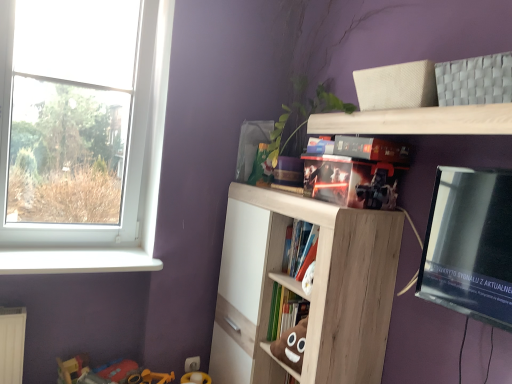
In the scene shown: What is the approximate width of light wood shelf at upper center, which is the second shelf from top to bottom?

It is 14.32 inches.

The height and width of the screenshot is (384, 512). Find the location of `brown plush toy at center, the third book positioned from the top`. brown plush toy at center, the third book positioned from the top is located at coordinates (285, 310).

The width and height of the screenshot is (512, 384). Describe the element at coordinates (76, 260) in the screenshot. I see `white plastic window sill at lower left` at that location.

Measure the distance between light wood shelf at upper center, placed as the first shelf when sorted from top to bottom, and camera.

1.11 meters.

Identify the location of transparent glass window at left. (124, 182).

Locate an element on the screen. The height and width of the screenshot is (384, 512). toy that is under the hardcover book at center, which is counted as the second book, starting from the bottom (from a real-world perspective) is located at coordinates (108, 373).

Who is taller, hardcover book at center, the second book positioned from the top, or plastic toy at lower left?

With more height is plastic toy at lower left.

From a real-world perspective, is hardcover book at center, which is counted as the second book, starting from the bottom, physically located above or below plastic toy at lower left?

hardcover book at center, which is counted as the second book, starting from the bottom, is above plastic toy at lower left.

Can you confirm if hardcover book at center, the second book positioned from the top, is thinner than plastic toy at lower left?

Indeed, hardcover book at center, the second book positioned from the top, has a lesser width compared to plastic toy at lower left.

From the image's perspective, which object appears higher, white plastic window sill at lower left or plastic toy at lower left?

white plastic window sill at lower left.

Considering the sizes of objects white plastic window sill at lower left and plastic toy at lower left in the image provided, who is shorter, white plastic window sill at lower left or plastic toy at lower left?

white plastic window sill at lower left.

Is the position of white plastic window sill at lower left less distant than that of plastic toy at lower left?

Yes, it is.

From a real-world perspective, is white plastic window sill at lower left positioned above or below plastic toy at lower left?

white plastic window sill at lower left is above plastic toy at lower left.

In order to click on shelf that appears on the right of brown plush toy at center, the first book when ordered from bottom to top in this screenshot , I will do `click(418, 121)`.

From a real-world perspective, is light wood shelf at upper center, placed as the first shelf when sorted from top to bottom, over brown plush toy at center, the first book when ordered from bottom to top?

Yes, from a real-world perspective, light wood shelf at upper center, placed as the first shelf when sorted from top to bottom, is on top of brown plush toy at center, the first book when ordered from bottom to top.

Considering the sizes of objects light wood shelf at upper center, placed as the first shelf when sorted from top to bottom, and brown plush toy at center, the third book positioned from the top, in the image provided, who is taller, light wood shelf at upper center, placed as the first shelf when sorted from top to bottom, or brown plush toy at center, the third book positioned from the top,?

brown plush toy at center, the third book positioned from the top, is taller.

From the image's perspective, is light wood shelf at upper center, the second shelf when ordered from bottom to top, located above brown plush toy at center, the third book positioned from the top?

Answer: Correct, light wood shelf at upper center, the second shelf when ordered from bottom to top, appears higher than brown plush toy at center, the third book positioned from the top, in the image.

Based on the photo, how many degrees apart are the facing directions of brown plush toy at center, the first book when ordered from bottom to top, and light wood shelf at upper center, which is the second shelf from top to bottom?

They differ by 0.000579 degrees in their facing directions.

In the scene shown: Is brown plush toy at center, the third book positioned from the top, positioned with its back to light wood shelf at upper center, which is the 1th shelf in bottom-to-top order?

Yes, brown plush toy at center, the third book positioned from the top, is positioned with its back facing light wood shelf at upper center, which is the 1th shelf in bottom-to-top order.

From the image's perspective, is brown plush toy at center, the third book positioned from the top, below light wood shelf at upper center, which is the 1th shelf in bottom-to-top order?

No, from the image's perspective, brown plush toy at center, the third book positioned from the top, is not below light wood shelf at upper center, which is the 1th shelf in bottom-to-top order.

Does point (286, 326) appear closer or farther from the camera than point (274, 382)?

Point (286, 326).

At what (x,y) coordinates should I click in order to perform the action: click on book that is the 2nd one when counting downward from the matt cardboard box at upper center, marked as the 3th book in a bottom-to-top arrangement (from the image's perspective). Please return your answer as a coordinate pair (x, y). Looking at the image, I should click on (285, 310).

From a real-world perspective, which is physically above, matt cardboard box at upper center, marked as the 3th book in a bottom-to-top arrangement, or brown plush toy at center, the third book positioned from the top?

matt cardboard box at upper center, marked as the 3th book in a bottom-to-top arrangement.

How many degrees apart are the facing directions of matt cardboard box at upper center, acting as the first book starting from the top, and brown plush toy at center, the third book positioned from the top?

The angular difference between matt cardboard box at upper center, acting as the first book starting from the top, and brown plush toy at center, the third book positioned from the top, is 1.79 degrees.

Is point (360, 158) more distant than point (284, 298)?

No, it is not.

Is light wood shelf at upper center, the second shelf when ordered from bottom to top, surrounding white plastic window sill at lower left?

No, light wood shelf at upper center, the second shelf when ordered from bottom to top, does not contain white plastic window sill at lower left.

Is light wood shelf at upper center, placed as the first shelf when sorted from top to bottom, at the left side of white plastic window sill at lower left?

No, light wood shelf at upper center, placed as the first shelf when sorted from top to bottom, is not to the left of white plastic window sill at lower left.

Could you tell me if light wood shelf at upper center, the second shelf when ordered from bottom to top, is turned towards white plastic window sill at lower left?

No, light wood shelf at upper center, the second shelf when ordered from bottom to top, is not aimed at white plastic window sill at lower left.

Considering the relative sizes of light wood shelf at upper center, the second shelf when ordered from bottom to top, and white plastic window sill at lower left in the image provided, is light wood shelf at upper center, the second shelf when ordered from bottom to top, shorter than white plastic window sill at lower left?

In fact, light wood shelf at upper center, the second shelf when ordered from bottom to top, may be taller than white plastic window sill at lower left.

Is black glossy tv at upper right to the left of matt cardboard box at upper center, marked as the 3th book in a bottom-to-top arrangement, from the viewer's perspective?

Incorrect, black glossy tv at upper right is not on the left side of matt cardboard box at upper center, marked as the 3th book in a bottom-to-top arrangement.

I want to click on the 1st book counting from the left side of the black glossy tv at upper right, so click(356, 171).

Identify the location of toy on the left of hardcover book at center, the second book positioned from the top. The image size is (512, 384). (108, 373).

Locate an element on the screen. toy on the right of white plastic window sill at lower left is located at coordinates (108, 373).

Looking at the image, which one is located closer to black glossy tv at upper right, hardcover book at center, the second book positioned from the top, or brown plush toy at center, the first book when ordered from bottom to top?

The object closer to black glossy tv at upper right is hardcover book at center, the second book positioned from the top.

Considering their positions, is light wood shelf at upper center, which is the second shelf from top to bottom, positioned further to black glossy tv at upper right than light wood shelf at upper center, placed as the first shelf when sorted from top to bottom?

Based on the image, light wood shelf at upper center, which is the second shelf from top to bottom, appears to be further to black glossy tv at upper right.

Considering their positions, is light wood shelf at upper center, which is the 1th shelf in bottom-to-top order, positioned closer to brown plush toy at center, the first book when ordered from bottom to top, than plastic toy at lower left?

light wood shelf at upper center, which is the 1th shelf in bottom-to-top order, is positioned closer to the anchor brown plush toy at center, the first book when ordered from bottom to top.

Based on their spatial positions, is plastic toy at lower left or transparent glass window at left closer to matt cardboard box at upper center, acting as the first book starting from the top?

The object closer to matt cardboard box at upper center, acting as the first book starting from the top, is transparent glass window at left.

Estimate the real-world distances between objects in this image. Which object is closer to black glossy tv at upper right, brown plush toy at center, the third book positioned from the top, or plastic toy at lower left?

brown plush toy at center, the third book positioned from the top, is closer to black glossy tv at upper right.

From the image, which object appears to be nearer to hardcover book at center, the second book positioned from the top, transparent glass window at left or brown plush toy at center, the first book when ordered from bottom to top?

The object closer to hardcover book at center, the second book positioned from the top, is brown plush toy at center, the first book when ordered from bottom to top.

Based on their spatial positions, is light wood shelf at upper center, placed as the first shelf when sorted from top to bottom, or transparent glass window at left further from white plastic window sill at lower left?

The object further to white plastic window sill at lower left is light wood shelf at upper center, placed as the first shelf when sorted from top to bottom.

From the picture: When comparing their distances from black glossy tv at upper right, does hardcover book at center, which is counted as the second book, starting from the bottom, or light wood shelf at upper center, placed as the first shelf when sorted from top to bottom, seem closer?

The object closer to black glossy tv at upper right is light wood shelf at upper center, placed as the first shelf when sorted from top to bottom.

Identify the location of toy between white plastic window sill at lower left and brown plush toy at center, the third book positioned from the top, in the horizontal direction. This screenshot has width=512, height=384. (108, 373).

Find the location of a particular element. toy between white plastic window sill at lower left and black glossy tv at upper right is located at coordinates (108, 373).

Locate an element on the screen. The width and height of the screenshot is (512, 384). window screen between light wood shelf at upper center, placed as the first shelf when sorted from top to bottom, and light wood shelf at upper center, which is the second shelf from top to bottom, in the up-down direction is located at coordinates (470, 245).

Where is `window sill between transparent glass window at left and brown plush toy at center, the first book when ordered from bottom to top`? Image resolution: width=512 pixels, height=384 pixels. window sill between transparent glass window at left and brown plush toy at center, the first book when ordered from bottom to top is located at coordinates (76, 260).